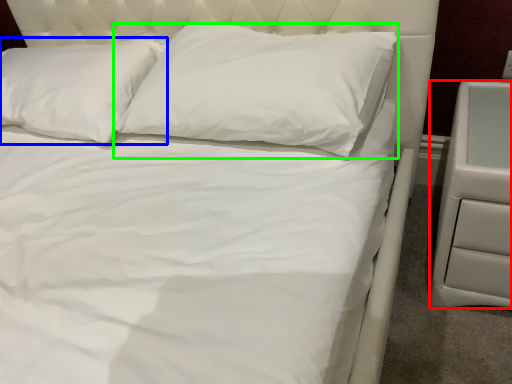
Question: Considering the real-world distances, which object is farthest from nightstand (highlighted by a red box)? pillow (highlighted by a blue box) or pillow (highlighted by a green box)?

Choices:
 (A) pillow
 (B) pillow

Answer: (A)